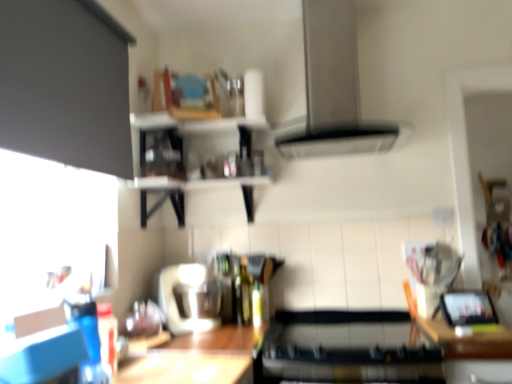
Question: From a real-world perspective, is wooden at right over wooden shelves at upper center?

Choices:
 (A) no
 (B) yes

Answer: (A)

Question: From the image's perspective, would you say wooden at right is shown under wooden shelves at upper center?

Choices:
 (A) no
 (B) yes

Answer: (B)

Question: Is wooden at right to the left of wooden shelves at upper center from the viewer's perspective?

Choices:
 (A) no
 (B) yes

Answer: (A)

Question: Is wooden shelves at upper center at the back of wooden at right?

Choices:
 (A) no
 (B) yes

Answer: (A)

Question: Does wooden at right have a greater width compared to wooden shelves at upper center?

Choices:
 (A) yes
 (B) no

Answer: (A)

Question: Does wooden at right have a lesser width compared to wooden shelves at upper center?

Choices:
 (A) yes
 (B) no

Answer: (B)

Question: Does satin silver exhaust hood at upper center have a greater height compared to black matte stove at center, the 2th appliance viewed from the left?

Choices:
 (A) yes
 (B) no

Answer: (A)

Question: Could you tell me if satin silver exhaust hood at upper center is facing black matte stove at center, the first appliance when ordered from right to left?

Choices:
 (A) no
 (B) yes

Answer: (A)

Question: Considering the relative positions of satin silver exhaust hood at upper center and black matte stove at center, the 2th appliance viewed from the left, in the image provided, is satin silver exhaust hood at upper center to the left of black matte stove at center, the 2th appliance viewed from the left, from the viewer's perspective?

Choices:
 (A) no
 (B) yes

Answer: (B)

Question: Considering the relative sizes of satin silver exhaust hood at upper center and black matte stove at center, the first appliance when ordered from right to left, in the image provided, is satin silver exhaust hood at upper center thinner than black matte stove at center, the first appliance when ordered from right to left,?

Choices:
 (A) yes
 (B) no

Answer: (A)

Question: Is satin silver exhaust hood at upper center positioned in front of black matte stove at center, the 2th appliance viewed from the left?

Choices:
 (A) no
 (B) yes

Answer: (A)

Question: Considering the relative sizes of satin silver exhaust hood at upper center and black matte stove at center, the 2th appliance viewed from the left, in the image provided, is satin silver exhaust hood at upper center wider than black matte stove at center, the 2th appliance viewed from the left,?

Choices:
 (A) no
 (B) yes

Answer: (A)

Question: Considering the relative sizes of green glass bottle at center and wooden table at lower center in the image provided, is green glass bottle at center taller than wooden table at lower center?

Choices:
 (A) yes
 (B) no

Answer: (A)